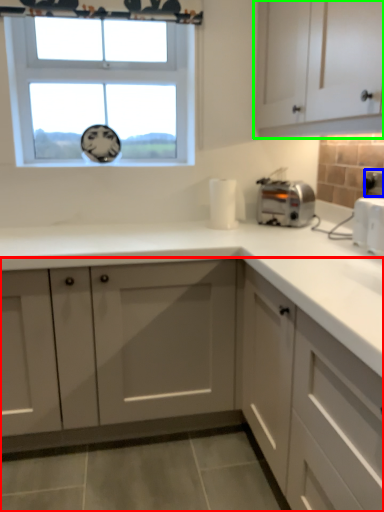
Question: Estimate the real-world distances between objects in this image. Which object is farther from cabinetry (highlighted by a red box), electric outlet (highlighted by a blue box) or cabinetry (highlighted by a green box)?

Choices:
 (A) electric outlet
 (B) cabinetry

Answer: (A)